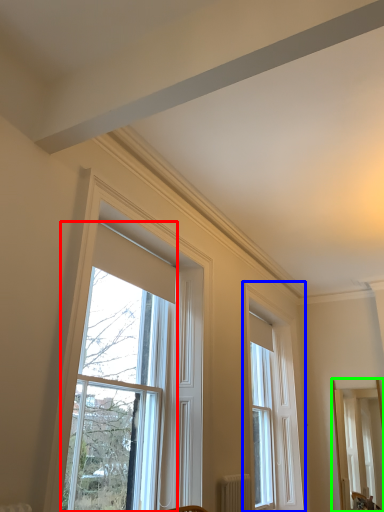
Question: Considering the real-world distances, which object is closest to window (highlighted by a red box)? window (highlighted by a blue box) or mirror (highlighted by a green box).

Choices:
 (A) window
 (B) mirror

Answer: (A)